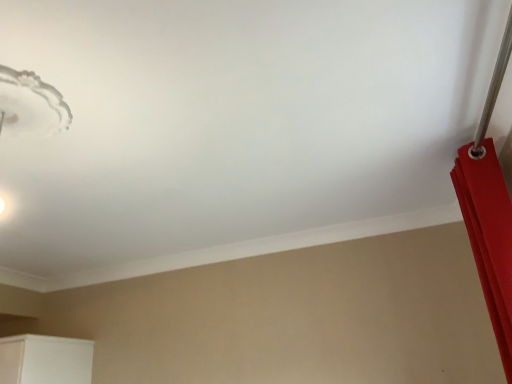
Image resolution: width=512 pixels, height=384 pixels. What do you see at coordinates (489, 238) in the screenshot?
I see `matte red curtain at right` at bounding box center [489, 238].

This screenshot has width=512, height=384. Find the location of `matte red curtain at right`. matte red curtain at right is located at coordinates (489, 238).

What do you see at coordinates (30, 106) in the screenshot? I see `white frosted glass lampshade at upper left` at bounding box center [30, 106].

Find the location of a particular element. Image resolution: width=512 pixels, height=384 pixels. white frosted glass lampshade at upper left is located at coordinates (30, 106).

Locate an element on the screen. Image resolution: width=512 pixels, height=384 pixels. matte red curtain at right is located at coordinates (x=489, y=238).

Would you say white frosted glass lampshade at upper left is to the left or to the right of matte red curtain at right in the picture?

white frosted glass lampshade at upper left is positioned on matte red curtain at right's left side.

Between white frosted glass lampshade at upper left and matte red curtain at right, which one is positioned in front?

Positioned in front is white frosted glass lampshade at upper left.

Is point (41, 112) positioned before point (496, 260)?

Yes, point (41, 112) is closer to viewer.

Looking at this image, from the image's perspective, who appears lower, white frosted glass lampshade at upper left or matte red curtain at right?

matte red curtain at right.

From a real-world perspective, which object stands above the other?

From a 3D spatial view, white frosted glass lampshade at upper left is above.

Which object is thinner, white frosted glass lampshade at upper left or matte red curtain at right?

matte red curtain at right is thinner.

Which of these two, white frosted glass lampshade at upper left or matte red curtain at right, stands shorter?

With less height is white frosted glass lampshade at upper left.

Who is smaller, white frosted glass lampshade at upper left or matte red curtain at right?

Smaller between the two is white frosted glass lampshade at upper left.

Would you say white frosted glass lampshade at upper left is outside matte red curtain at right?

Indeed, white frosted glass lampshade at upper left is completely outside matte red curtain at right.

Is white frosted glass lampshade at upper left in contact with matte red curtain at right?

No, white frosted glass lampshade at upper left is not beside matte red curtain at right.

Is white frosted glass lampshade at upper left looking in the opposite direction of matte red curtain at right?

No, white frosted glass lampshade at upper left's orientation is not away from matte red curtain at right.

Can you tell me how much white frosted glass lampshade at upper left and matte red curtain at right differ in facing direction?

They differ by 0.694 degrees in their facing directions.

Identify the location of curtain located behind the white frosted glass lampshade at upper left. (489, 238).

From the picture: Can you confirm if matte red curtain at right is positioned to the right of white frosted glass lampshade at upper left?

Yes, matte red curtain at right is to the right of white frosted glass lampshade at upper left.

Which object is more forward, matte red curtain at right or white frosted glass lampshade at upper left?

white frosted glass lampshade at upper left.

Which is closer, [477,268] or [46,94]?

The point [46,94] is closer to the camera.

From the image's perspective, is matte red curtain at right positioned above or below white frosted glass lampshade at upper left?

Based on their image positions, matte red curtain at right is located beneath white frosted glass lampshade at upper left.

From a real-world perspective, is matte red curtain at right over white frosted glass lampshade at upper left?

No, from a real-world perspective, matte red curtain at right is not above white frosted glass lampshade at upper left.

From the picture: Does matte red curtain at right have a greater width compared to white frosted glass lampshade at upper left?

Incorrect, the width of matte red curtain at right does not surpass that of white frosted glass lampshade at upper left.

Which of these two, matte red curtain at right or white frosted glass lampshade at upper left, stands shorter?

white frosted glass lampshade at upper left is shorter.

In terms of size, does matte red curtain at right appear bigger or smaller than white frosted glass lampshade at upper left?

matte red curtain at right is bigger than white frosted glass lampshade at upper left.

Is white frosted glass lampshade at upper left located within matte red curtain at right?

That's incorrect, white frosted glass lampshade at upper left is not inside matte red curtain at right.

Is matte red curtain at right with white frosted glass lampshade at upper left?

No, matte red curtain at right is not in contact with white frosted glass lampshade at upper left.

Is matte red curtain at right turned away from white frosted glass lampshade at upper left?

No, matte red curtain at right is not facing away from white frosted glass lampshade at upper left.

What's the angular difference between matte red curtain at right and white frosted glass lampshade at upper left's facing directions?

Answer: They differ by 0.694 degrees in their facing directions.

The image size is (512, 384). Find the location of `lamp above the matte red curtain at right (from a real-world perspective)`. lamp above the matte red curtain at right (from a real-world perspective) is located at coordinates (30, 106).

Identify the location of curtain behind the white frosted glass lampshade at upper left. The width and height of the screenshot is (512, 384). (489, 238).

Where is `lamp that is on the left side of matte red curtain at right`? This screenshot has height=384, width=512. lamp that is on the left side of matte red curtain at right is located at coordinates (30, 106).